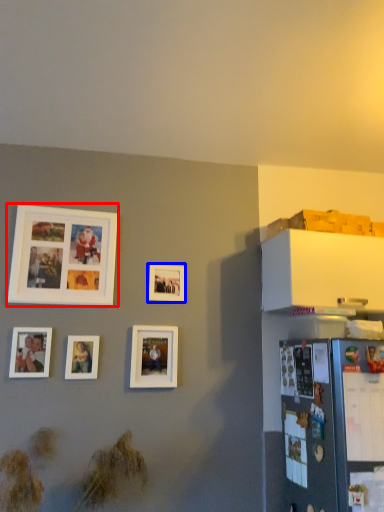
Question: Among these objects, which one is nearest to the camera, picture frame (highlighted by a red box) or picture frame (highlighted by a blue box)?

Choices:
 (A) picture frame
 (B) picture frame

Answer: (A)